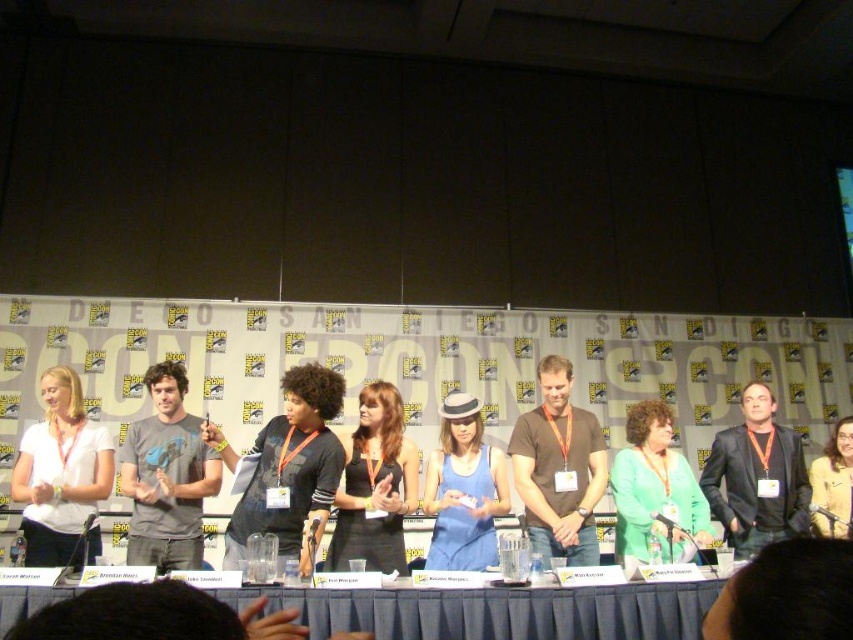
Question: Which of the following is the farthest from the observer?

Choices:
 (A) (303, 404)
 (B) (751, 499)
 (C) (584, 524)
 (D) (141, 492)

Answer: (B)

Question: Can you confirm if black matte dress at center is thinner than green matte sweater at center?

Choices:
 (A) no
 (B) yes

Answer: (B)

Question: Estimate the real-world distances between objects in this image. Which object is closer to the black leather jacket at center?

Choices:
 (A) black matte dress at center
 (B) brown cotton t-shirt at center
 (C) gray t-shirt at center

Answer: (B)

Question: Among these points, which one is nearest to the camera?

Choices:
 (A) (329, 497)
 (B) (822, 499)
 (C) (801, 483)

Answer: (A)

Question: Is blue fabric table at center below green matte sweater at center?

Choices:
 (A) no
 (B) yes

Answer: (B)

Question: Does white matte shirt at center have a larger size compared to brown cotton t-shirt at center?

Choices:
 (A) no
 (B) yes

Answer: (B)